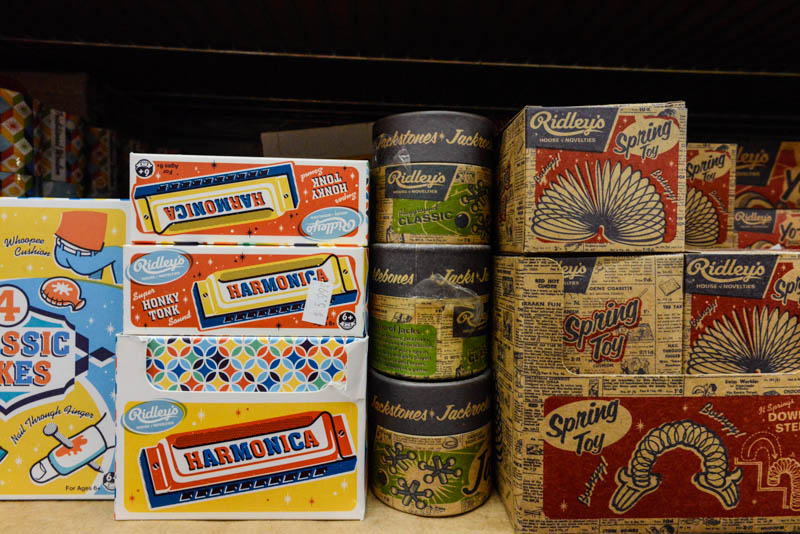
Image resolution: width=800 pixels, height=534 pixels. I want to click on screws, so click(154, 467), click(340, 436).